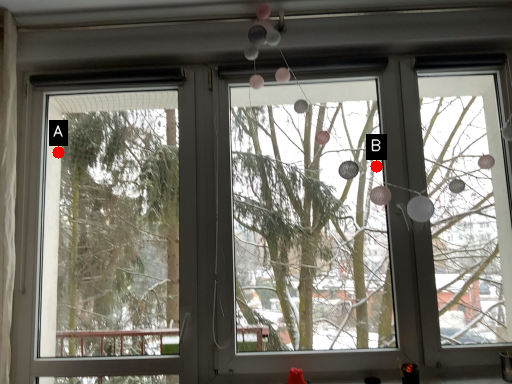
Question: Two points are circled on the image, labeled by A and B beside each circle. Which point appears farthest from the camera in this image?

Choices:
 (A) A is further
 (B) B is further

Answer: (B)